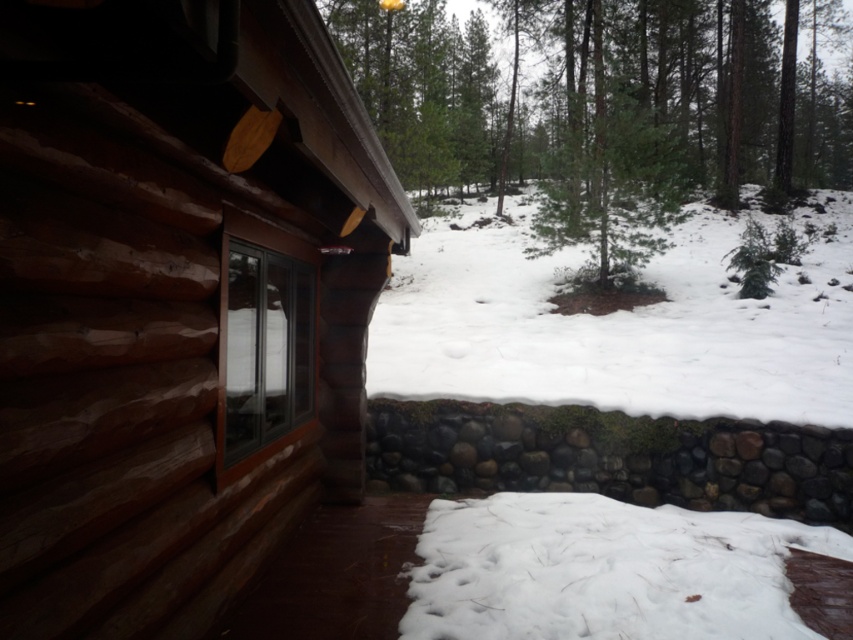
Does brown wooden cabin at left appear on the right side of green textured pine tree at center?

No, brown wooden cabin at left is not to the right of green textured pine tree at center.

Can you confirm if brown wooden cabin at left is smaller than green textured pine tree at center?

Correct, brown wooden cabin at left occupies less space than green textured pine tree at center.

The height and width of the screenshot is (640, 853). Identify the location of brown wooden cabin at left. (177, 301).

In the scene shown: Can you confirm if brown wooden cabin at left is taller than white fluffy snow at center?

In fact, brown wooden cabin at left may be shorter than white fluffy snow at center.

Which is in front, point (44, 195) or point (637, 381)?

Positioned in front is point (44, 195).

The image size is (853, 640). In order to click on brown wooden cabin at left in this screenshot , I will do `click(177, 301)`.

Does white fluffy snow at center have a lesser height compared to white fluffy snow at lower center?

No.

Between white fluffy snow at center and white fluffy snow at lower center, which one is positioned higher?

white fluffy snow at center

Is point (511, 211) behind point (619, 589)?

Yes, point (511, 211) is farther from viewer.

Where is `white fluffy snow at center`? The height and width of the screenshot is (640, 853). white fluffy snow at center is located at coordinates (618, 324).